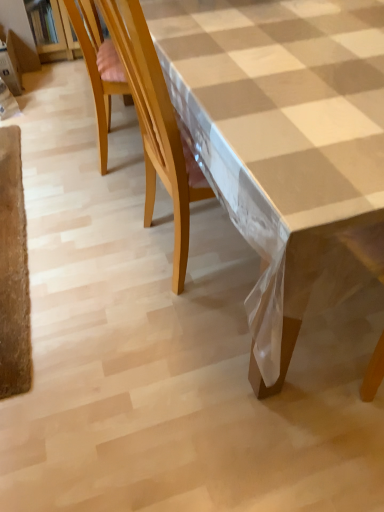
Question: Is white checkered tablecloth at center positioned before wooden chair at left?

Choices:
 (A) no
 (B) yes

Answer: (B)

Question: From the image's perspective, is white checkered tablecloth at center on wooden chair at left?

Choices:
 (A) yes
 (B) no

Answer: (B)

Question: Is white checkered tablecloth at center at the left side of wooden chair at left?

Choices:
 (A) no
 (B) yes

Answer: (A)

Question: From the image's perspective, does white checkered tablecloth at center appear lower than wooden chair at left?

Choices:
 (A) yes
 (B) no

Answer: (A)

Question: Is white checkered tablecloth at center taller than wooden chair at left?

Choices:
 (A) no
 (B) yes

Answer: (B)

Question: Are white checkered tablecloth at center and wooden chair at left located far from each other?

Choices:
 (A) no
 (B) yes

Answer: (A)

Question: From the image's perspective, would you say wooden chair at left is positioned over white checkered tablecloth at center?

Choices:
 (A) yes
 (B) no

Answer: (A)

Question: Would you consider wooden chair at left to be distant from white checkered tablecloth at center?

Choices:
 (A) yes
 (B) no

Answer: (B)

Question: From a real-world perspective, is wooden chair at left below white checkered tablecloth at center?

Choices:
 (A) no
 (B) yes

Answer: (B)

Question: Can we say wooden chair at left lies outside white checkered tablecloth at center?

Choices:
 (A) no
 (B) yes

Answer: (B)

Question: Is wooden chair at left further to camera compared to white checkered tablecloth at center?

Choices:
 (A) yes
 (B) no

Answer: (A)

Question: Is wooden chair at left oriented towards white checkered tablecloth at center?

Choices:
 (A) no
 (B) yes

Answer: (B)

Question: From a real-world perspective, is white checkered tablecloth at center positioned above or below wooden chair at left?

Choices:
 (A) below
 (B) above

Answer: (B)